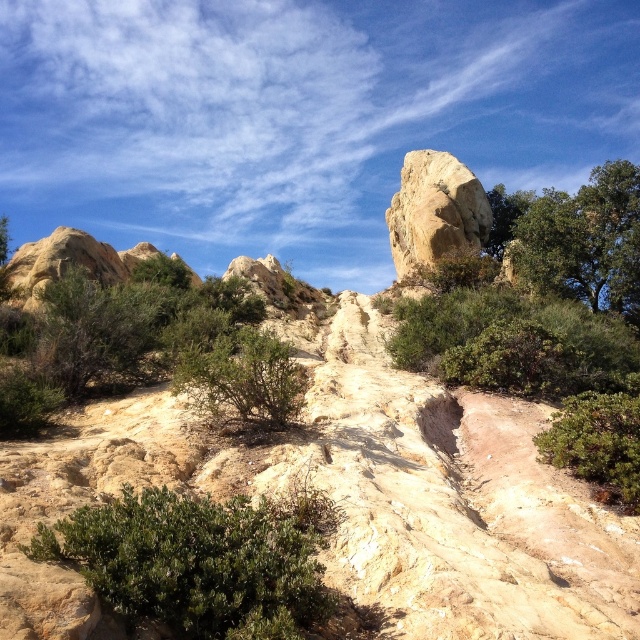
Is green leafy tree at upper right above rustic stone boulder at center?

Yes.

Who is shorter, green leafy tree at upper right or rustic stone boulder at center?

Standing shorter between the two is rustic stone boulder at center.

Where is `green leafy tree at upper right`? This screenshot has width=640, height=640. green leafy tree at upper right is located at coordinates point(579,240).

Is green leafy bush at center positioned behind green leafy bush at lower right?

Yes, green leafy bush at center is further from the viewer.

Does point (12, 390) lie behind point (595, 403)?

Yes, it is behind point (595, 403).

The height and width of the screenshot is (640, 640). What are the coordinates of `green leafy bush at center` in the screenshot? It's located at (138, 342).

Does green leafy bush at lower left come in front of green leafy bush at lower right?

Yes, green leafy bush at lower left is closer to the viewer.

In the scene shown: Can you confirm if green leafy bush at lower left is taller than green leafy bush at lower right?

No, green leafy bush at lower left is not taller than green leafy bush at lower right.

What do you see at coordinates (198, 561) in the screenshot? I see `green leafy bush at lower left` at bounding box center [198, 561].

Identify the location of green leafy bush at lower left. The height and width of the screenshot is (640, 640). (198, 561).